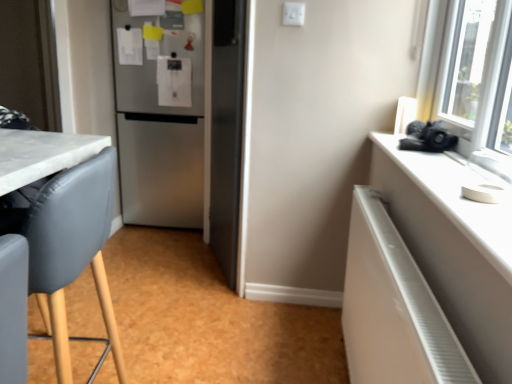
Measure the distance between matte gray chair at left and camera.

A distance of 91.27 centimeters exists between matte gray chair at left and camera.

At what (x,y) coordinates should I click in order to perform the action: click on matte gray chair at left. Please return your answer as a coordinate pair (x, y). This screenshot has width=512, height=384. Looking at the image, I should click on (73, 246).

Identify the location of satin silver refrigerator at center. The height and width of the screenshot is (384, 512). (160, 112).

Image resolution: width=512 pixels, height=384 pixels. In order to click on cabinetry on the right of matte gray chair at left in this screenshot , I will do `click(423, 277)`.

From a real-world perspective, between white glossy radiator at right and matte gray chair at left, who is vertically higher?

From a 3D spatial view, matte gray chair at left is above.

How different are the orientations of white glossy radiator at right and matte gray chair at left in degrees?

5.92 degrees separate the facing orientations of white glossy radiator at right and matte gray chair at left.

What's the angular difference between satin silver refrigerator at center and matte gray chair at left's facing directions?

They differ by 84.1 degrees in their facing directions.

Which is behind, satin silver refrigerator at center or matte gray chair at left?

Positioned behind is satin silver refrigerator at center.

From a real-world perspective, is satin silver refrigerator at center positioned above or below matte gray chair at left?

From a real-world perspective, satin silver refrigerator at center is physically above matte gray chair at left.

Does white glossy radiator at right have a lesser height compared to satin silver refrigerator at center?

Yes.

Considering the sizes of objects white glossy radiator at right and satin silver refrigerator at center in the image provided, who is bigger, white glossy radiator at right or satin silver refrigerator at center?

satin silver refrigerator at center is bigger.

From a real-world perspective, is white glossy radiator at right positioned above or below satin silver refrigerator at center?

white glossy radiator at right is situated lower than satin silver refrigerator at center in the real world.

Considering the positions of point (58, 200) and point (181, 211), is point (58, 200) closer or farther from the camera than point (181, 211)?

Point (58, 200) appears to be closer to the viewer than point (181, 211).

Are matte gray chair at left and satin silver refrigerator at center far apart?

Yes.

Which object is positioned more to the left, matte gray chair at left or satin silver refrigerator at center?

matte gray chair at left.

Is satin silver refrigerator at center turned away from white glossy radiator at right?

satin silver refrigerator at center is not turned away from white glossy radiator at right.

Does satin silver refrigerator at center touch white glossy radiator at right?

No.

Is point (170, 201) positioned behind point (360, 254)?

That is True.

How different are the orientations of satin silver refrigerator at center and white glossy radiator at right in degrees?

90 degrees separate the facing orientations of satin silver refrigerator at center and white glossy radiator at right.

From the image's perspective, between matte gray chair at left and white glossy radiator at right, who is located below?

white glossy radiator at right is shown below in the image.

Can you confirm if matte gray chair at left is bigger than white glossy radiator at right?

Correct, matte gray chair at left is larger in size than white glossy radiator at right.

Is matte gray chair at left positioned with its back to white glossy radiator at right?

Yes, white glossy radiator at right is at the back of matte gray chair at left.

Identify the location of chair that appears behind the white glossy radiator at right. The width and height of the screenshot is (512, 384). (73, 246).

Image resolution: width=512 pixels, height=384 pixels. Find the location of `chair located in front of the satin silver refrigerator at center`. chair located in front of the satin silver refrigerator at center is located at coordinates (73, 246).

When comparing their distances from satin silver refrigerator at center, does matte gray chair at left or white glossy radiator at right seem closer?

matte gray chair at left.

Looking at the image, which one is located further to white glossy radiator at right, matte gray chair at left or satin silver refrigerator at center?

Among the two, satin silver refrigerator at center is located further to white glossy radiator at right.

Estimate the real-world distances between objects in this image. Which object is further from matte gray chair at left, satin silver refrigerator at center or white glossy radiator at right?

Based on the image, satin silver refrigerator at center appears to be further to matte gray chair at left.

Based on their spatial positions, is white glossy radiator at right or matte gray chair at left further from satin silver refrigerator at center?

white glossy radiator at right is positioned further to the anchor satin silver refrigerator at center.

Based on their spatial positions, is white glossy radiator at right or satin silver refrigerator at center closer to matte gray chair at left?

white glossy radiator at right is positioned closer to the anchor matte gray chair at left.

From the image, which object appears to be farther from white glossy radiator at right, satin silver refrigerator at center or matte gray chair at left?

satin silver refrigerator at center lies further to white glossy radiator at right than the other object.

At what (x,y) coordinates should I click in order to perform the action: click on chair positioned between white glossy radiator at right and satin silver refrigerator at center from near to far. Please return your answer as a coordinate pair (x, y). Image resolution: width=512 pixels, height=384 pixels. Looking at the image, I should click on (73, 246).